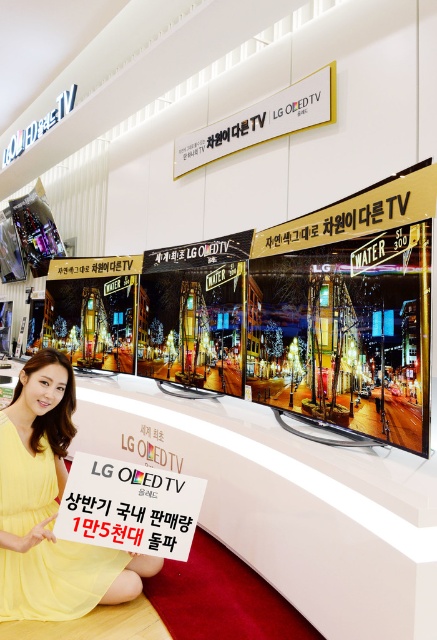
Question: Does yellow fabric dress at center appear over white paper sign at center?

Choices:
 (A) no
 (B) yes

Answer: (A)

Question: Among these points, which one is farthest from the camera?

Choices:
 (A) (329, 108)
 (B) (176, 497)

Answer: (A)

Question: Which point is closer to the camera?

Choices:
 (A) white metallic sign at upper center
 (B) yellow fabric dress at center
 (C) white paper sign at center

Answer: (C)

Question: Which point is closer to the camera taking this photo?

Choices:
 (A) (93, 456)
 (B) (215, 125)

Answer: (A)

Question: Does yellow fabric dress at center appear on the left side of white paper sign at center?

Choices:
 (A) no
 (B) yes

Answer: (B)

Question: Can you confirm if yellow fabric dress at center is bigger than white paper sign at center?

Choices:
 (A) yes
 (B) no

Answer: (A)